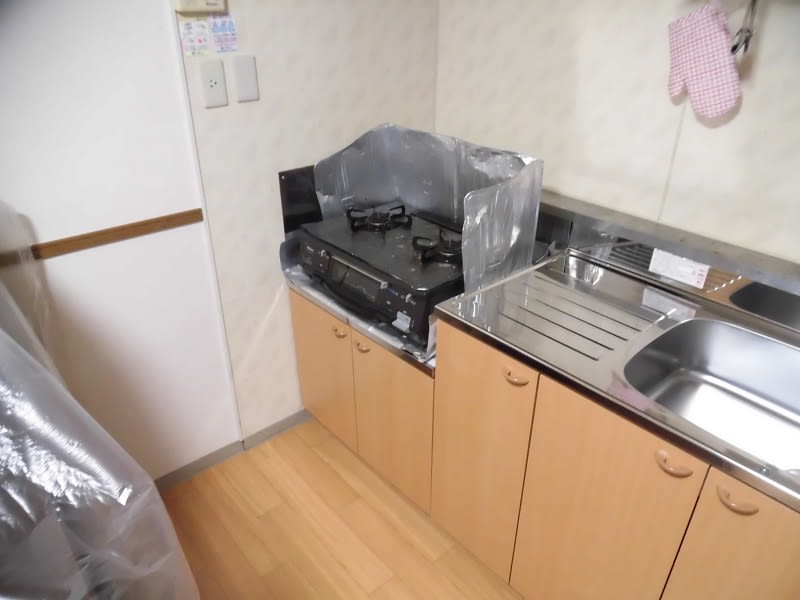
The width and height of the screenshot is (800, 600). I want to click on gas stove burner, so click(382, 219), click(442, 246).